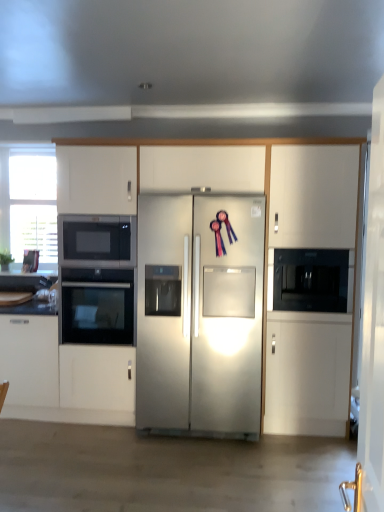
Question: Can you confirm if white glossy door at right is wider than stainless steel refrigerator at center?

Choices:
 (A) no
 (B) yes

Answer: (A)

Question: Is white glossy door at right facing away from stainless steel refrigerator at center?

Choices:
 (A) yes
 (B) no

Answer: (B)

Question: Considering the relative positions of white glossy door at right and stainless steel refrigerator at center in the image provided, is white glossy door at right to the left of stainless steel refrigerator at center from the viewer's perspective?

Choices:
 (A) yes
 (B) no

Answer: (B)

Question: Can you confirm if white glossy door at right is smaller than stainless steel refrigerator at center?

Choices:
 (A) no
 (B) yes

Answer: (B)

Question: Can you confirm if white glossy door at right is thinner than stainless steel refrigerator at center?

Choices:
 (A) yes
 (B) no

Answer: (A)

Question: Are white glossy door at right and stainless steel refrigerator at center making contact?

Choices:
 (A) yes
 (B) no

Answer: (B)

Question: Is black glass oven at left, marked as the first oven in a bottom-to-top arrangement, further to camera compared to stainless steel refrigerator at center?

Choices:
 (A) no
 (B) yes

Answer: (B)

Question: Can you confirm if black glass oven at left, acting as the second oven starting from the top, is thinner than stainless steel refrigerator at center?

Choices:
 (A) yes
 (B) no

Answer: (A)

Question: From a real-world perspective, does black glass oven at left, marked as the first oven in a bottom-to-top arrangement, sit lower than stainless steel refrigerator at center?

Choices:
 (A) no
 (B) yes

Answer: (B)

Question: Can you confirm if black glass oven at left, acting as the second oven starting from the top, is positioned to the left of stainless steel refrigerator at center?

Choices:
 (A) yes
 (B) no

Answer: (A)

Question: Is black glass oven at left, marked as the first oven in a bottom-to-top arrangement, oriented away from stainless steel refrigerator at center?

Choices:
 (A) yes
 (B) no

Answer: (B)

Question: From a real-world perspective, does black glass oven at left, acting as the second oven starting from the top, stand above stainless steel refrigerator at center?

Choices:
 (A) no
 (B) yes

Answer: (A)

Question: Is white glossy countertop at lower left far away from black glass oven at left, the 1th oven from the top?

Choices:
 (A) yes
 (B) no

Answer: (B)